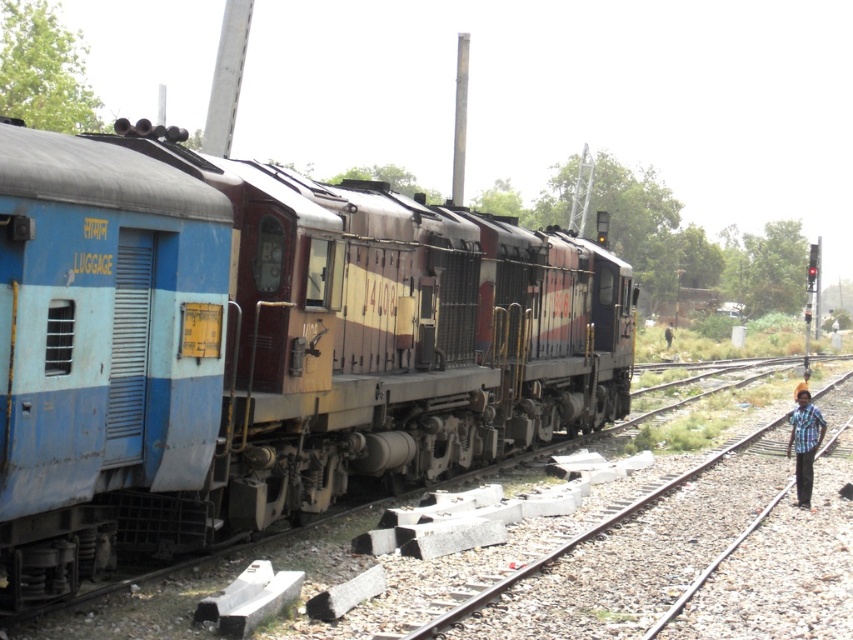
Does blue matte luggage at left have a lesser width compared to blue plaid shirt at right?

Incorrect, blue matte luggage at left's width is not less than blue plaid shirt at right's.

Between blue matte luggage at left and blue plaid shirt at right, which one is positioned higher?

Positioned higher is blue matte luggage at left.

Between point (221, 406) and point (810, 428), which one is positioned in front?

Point (221, 406) is more forward.

The height and width of the screenshot is (640, 853). Identify the location of blue matte luggage at left. (263, 346).

Is smooth metal train track at right behind blue plaid shirt at right?

No, smooth metal train track at right is closer to the viewer.

Is smooth metal train track at right smaller than blue plaid shirt at right?

Actually, smooth metal train track at right might be larger than blue plaid shirt at right.

At what (x,y) coordinates should I click in order to perform the action: click on smooth metal train track at right. Please return your answer as a coordinate pair (x, y). Image resolution: width=853 pixels, height=640 pixels. Looking at the image, I should click on (576, 540).

Identify the location of smooth metal train track at right. (576, 540).

Does point (83, 156) lie behind point (454, 614)?

No, (83, 156) is closer to viewer.

Is blue matte luggage at left to the right of smooth metal train track at right from the viewer's perspective?

In fact, blue matte luggage at left is to the left of smooth metal train track at right.

Find the location of a particular element. blue matte luggage at left is located at coordinates (263, 346).